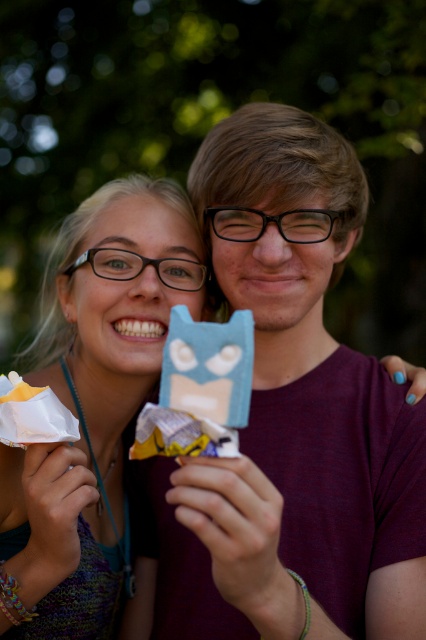
Question: Which point is closer to the camera?

Choices:
 (A) white paper wrapper at lower left
 (B) blue matte ice cream bar at center

Answer: (B)

Question: Which point is farther to the camera?

Choices:
 (A) blue matte ice cream bar at center
 (B) white paper wrapper at lower left
 (C) matte blue ice cream at center

Answer: (B)

Question: Is matte blue ice cream at center positioned behind blue matte ice cream bar at center?

Choices:
 (A) yes
 (B) no

Answer: (A)

Question: Which object appears closest to the camera in this image?

Choices:
 (A) blue matte ice cream bar at center
 (B) white paper wrapper at lower left
 (C) matte blue ice cream at center

Answer: (A)

Question: Is matte blue ice cream at center bigger than white paper wrapper at lower left?

Choices:
 (A) yes
 (B) no

Answer: (A)

Question: Is the position of blue matte ice cream bar at center less distant than that of white paper wrapper at lower left?

Choices:
 (A) no
 (B) yes

Answer: (B)